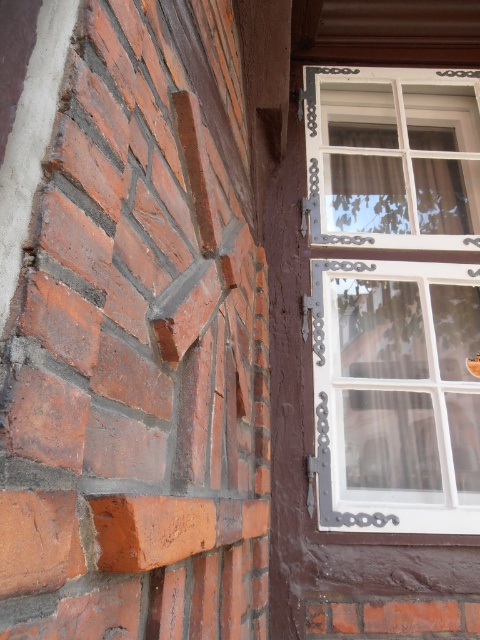
Which is above, red brick at left or smooth orange brick at lower left?

red brick at left

What do you see at coordinates (139, 348) in the screenshot?
I see `red brick at left` at bounding box center [139, 348].

Is point (149, 516) in front of point (183, 509)?

Yes.

At what (x,y) coordinates should I click in order to perform the action: click on red brick at left. Please return your answer as a coordinate pair (x, y). Image resolution: width=480 pixels, height=640 pixels. Looking at the image, I should click on (139, 348).

Is smooth orange brick at lower left in front of red clay brick at lower right?

Yes, smooth orange brick at lower left is closer to the viewer.

Who is positioned more to the right, smooth orange brick at lower left or red clay brick at lower right?

Positioned to the right is red clay brick at lower right.

Between point (93, 502) and point (386, 620), which one is positioned in front?

Point (93, 502) is in front.

The height and width of the screenshot is (640, 480). What are the coordinates of `smooth orange brick at lower left` in the screenshot? It's located at (151, 529).

Does red brick at left lie in front of white painted wood window at upper right?

Yes, red brick at left is closer to the viewer.

Is red brick at left bigger than white painted wood window at upper right?

Indeed, red brick at left has a larger size compared to white painted wood window at upper right.

Is point (267, 480) positioned behind point (342, 106)?

That is False.

This screenshot has height=640, width=480. I want to click on red brick at left, so click(x=139, y=348).